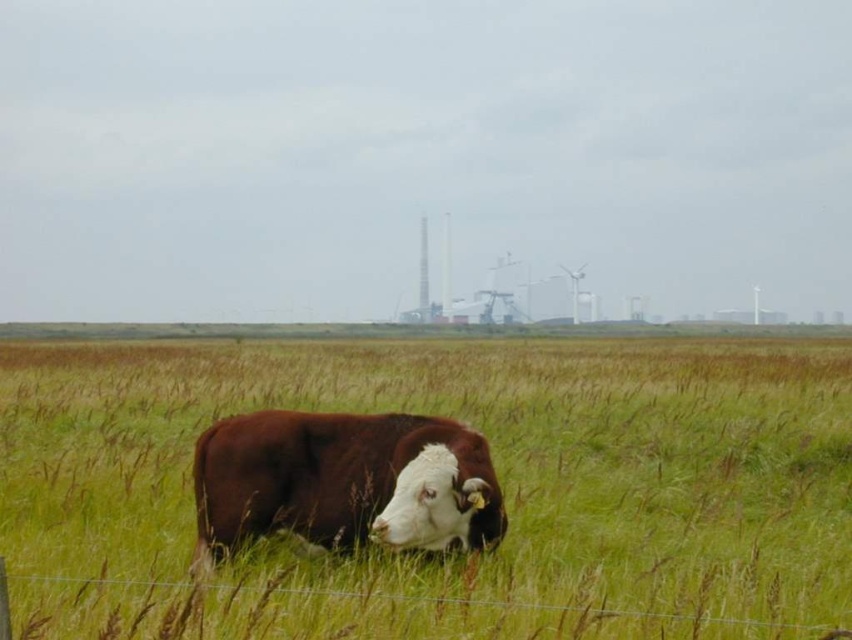
Question: Is green grassy field at center thinner than brown matte cow at center?

Choices:
 (A) yes
 (B) no

Answer: (B)

Question: Can you confirm if green grassy field at center is positioned to the left of brown matte cow at center?

Choices:
 (A) yes
 (B) no

Answer: (B)

Question: Which object appears closest to the camera in this image?

Choices:
 (A) brown matte cow at center
 (B) green grassy field at center

Answer: (B)

Question: From the image, what is the correct spatial relationship of green grassy field at center in relation to brown matte cow at center?

Choices:
 (A) above
 (B) below

Answer: (A)

Question: Which point is closer to the camera taking this photo?

Choices:
 (A) (153, 404)
 (B) (429, 490)

Answer: (B)